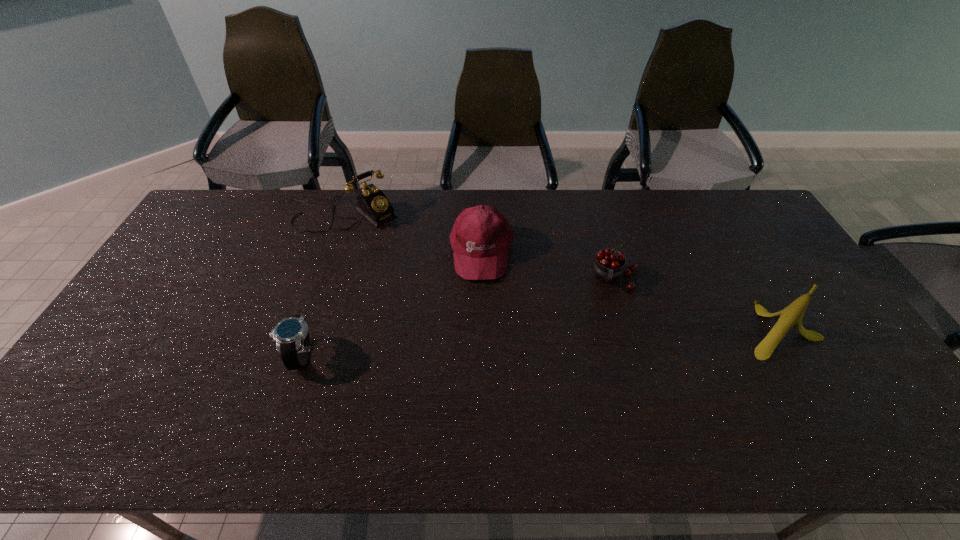
You are a GUI agent. You are given a task and a screenshot of the screen. Output one action in this format:
    pyautogui.click(x=<x>, y=<y>)
    Task: Click on the free space on the desktop that is between the watch and the rightmost object and is positioned on the dial of the telephone
    
    Given the screenshot: What is the action you would take?
    pyautogui.click(x=489, y=345)

This screenshot has height=540, width=960. Find the location of `vacant space on the desktop that is between the shortest object and the banana and is positioned on the handle side of the pot filled with cherries`. vacant space on the desktop that is between the shortest object and the banana and is positioned on the handle side of the pot filled with cherries is located at coordinates (612, 338).

You are a GUI agent. You are given a task and a screenshot of the screen. Output one action in this format:
    pyautogui.click(x=<x>, y=<y>)
    Task: Click on the free spot on the desktop that is between the watch and the banana and is positioned at the front of the third object from right to left with the brim
    The image size is (960, 540).
    Given the screenshot: What is the action you would take?
    pyautogui.click(x=483, y=346)